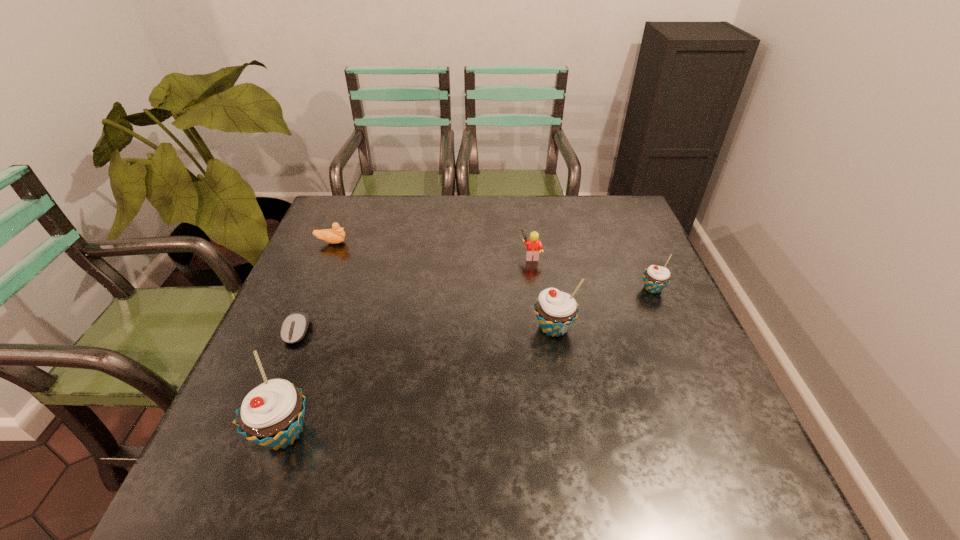
Locate an element on the screen. Image resolution: width=960 pixels, height=540 pixels. free location that satisfies the following two spatial constraints: 1. on the back side of the rightmost object; 2. on the right side of the nearest object is located at coordinates (335, 289).

At what (x,y) coordinates should I click in order to perform the action: click on vacant space that satisfies the following two spatial constraints: 1. in front of the Lego with the accessory visible; 2. on the left side of the third farthest object. Please return your answer as a coordinate pair (x, y). Looking at the image, I should click on (536, 289).